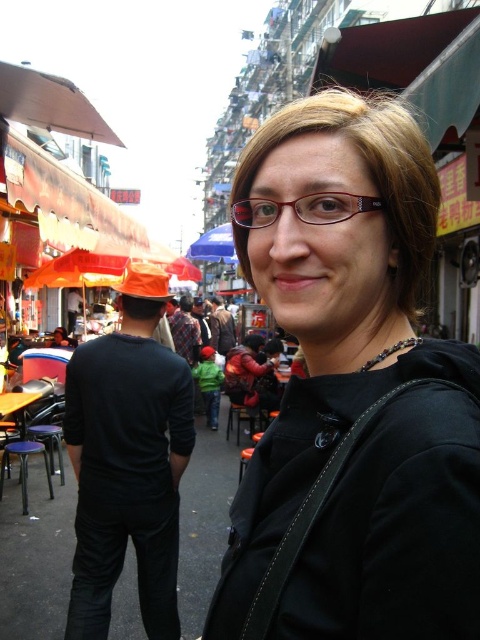
Which of these two, matte red glasses at center or blue fabric umbrella at center, stands taller?

Standing taller between the two is blue fabric umbrella at center.

In the scene shown: Is matte red glasses at center closer to the viewer compared to blue fabric umbrella at center?

Yes, matte red glasses at center is closer to the viewer.

Which is behind, point (252, 214) or point (212, 248)?

Point (212, 248)

Find the location of a particular element. Image resolution: width=480 pixels, height=640 pixels. matte red glasses at center is located at coordinates (303, 209).

Who is taller, matte black jacket at center or blue fabric umbrella at center?

Standing taller between the two is matte black jacket at center.

Is matte black jacket at center below blue fabric umbrella at center?

Yes, matte black jacket at center is below blue fabric umbrella at center.

This screenshot has height=640, width=480. Describe the element at coordinates (354, 397) in the screenshot. I see `matte black jacket at center` at that location.

This screenshot has width=480, height=640. Find the location of `matte black jacket at center`. matte black jacket at center is located at coordinates (354, 397).

Is black matte shirt at center taller than matte red glasses at center?

Indeed, black matte shirt at center has a greater height compared to matte red glasses at center.

Is point (168, 636) less distant than point (320, 211)?

No, it is not.

The width and height of the screenshot is (480, 640). I want to click on black matte shirt at center, so click(128, 460).